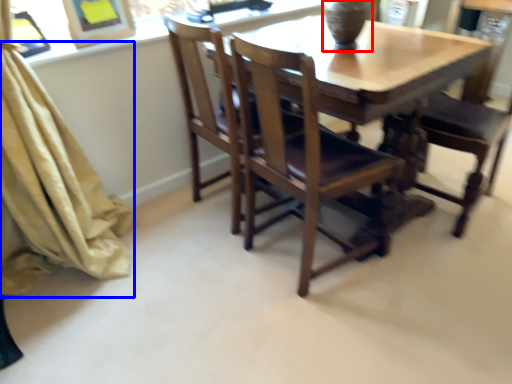
Question: Which point is closer to the camera, glass vase (highlighted by a red box) or curtain (highlighted by a blue box)?

Choices:
 (A) glass vase
 (B) curtain

Answer: (B)